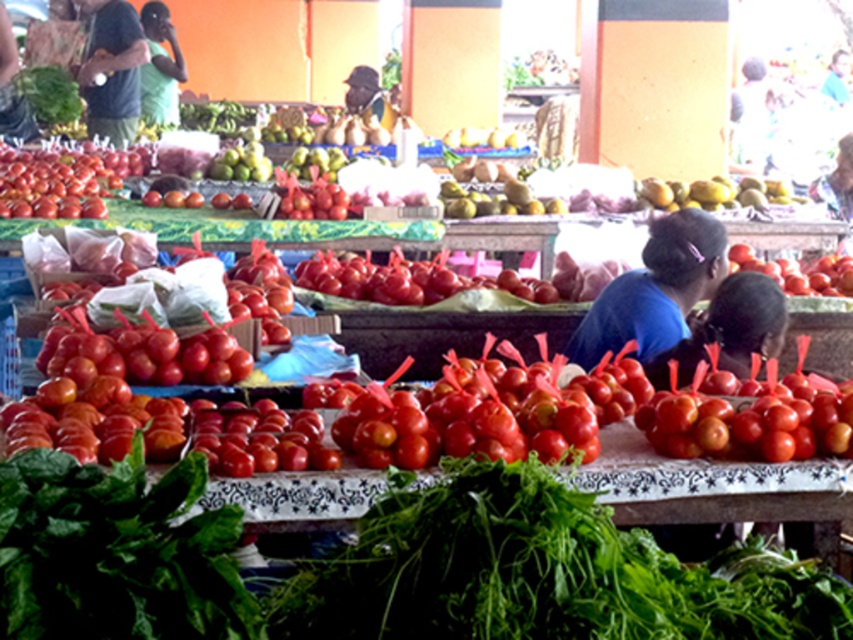
What do you see at coordinates (115, 552) in the screenshot? I see `green leafy at lower left` at bounding box center [115, 552].

Who is higher up, green leafy at lower left or green matte shirt at upper left?

green matte shirt at upper left is higher up.

Which is in front, point (134, 636) or point (173, 49)?

Point (134, 636) is more forward.

At what (x,y) coordinates should I click in order to perform the action: click on green leafy at lower left. Please return your answer as a coordinate pair (x, y). Looking at the image, I should click on (115, 552).

Can you confirm if red matte tomato at right is shorter than matte black shirt at upper left?

Indeed, red matte tomato at right has a lesser height compared to matte black shirt at upper left.

Looking at this image, does red matte tomato at right appear on the left side of matte black shirt at upper left?

No, red matte tomato at right is not to the left of matte black shirt at upper left.

The width and height of the screenshot is (853, 640). In order to click on red matte tomato at right in this screenshot , I will do `click(798, 273)`.

Can you confirm if smooth blue shirt at center is wider than matte black shirt at upper left?

No.

Does smooth blue shirt at center have a smaller size compared to matte black shirt at upper left?

Yes.

Describe the element at coordinates (729, 330) in the screenshot. I see `smooth blue shirt at center` at that location.

You are a GUI agent. You are given a task and a screenshot of the screen. Output one action in this format:
    pyautogui.click(x=<x>, y=<y>)
    Task: Click on the smooth blue shirt at center
    
    Given the screenshot: What is the action you would take?
    pyautogui.click(x=729, y=330)